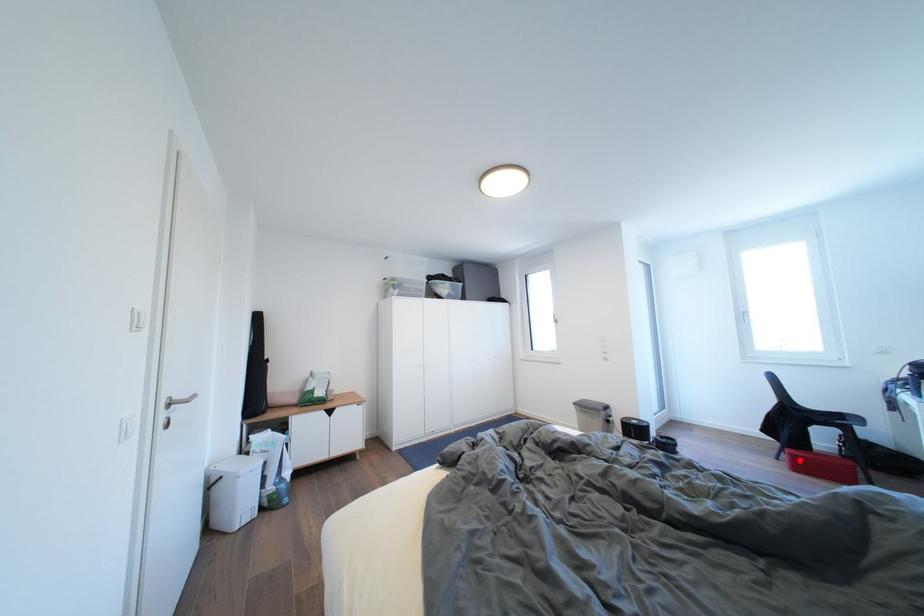
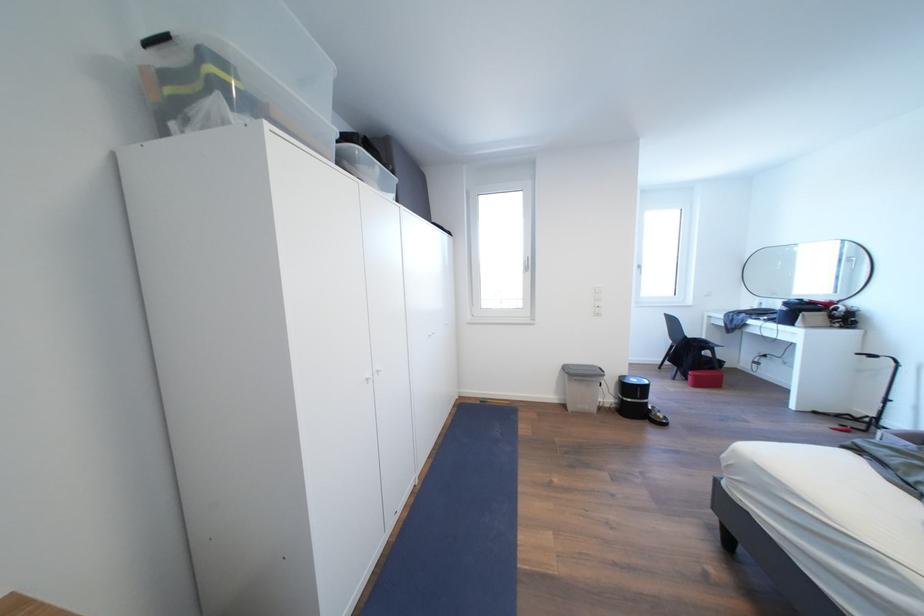
Locate, in the second image, the point that corresponds to the highlighted location in the first image.

(703, 381)